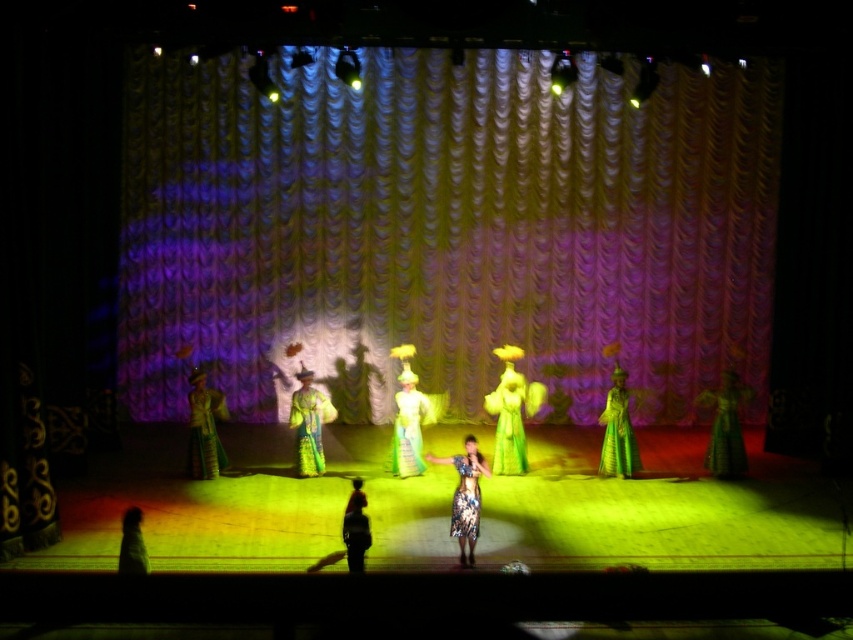
Looking at this image, you are a stagehand standing at the camera position. You need to place a microphone stand at point (x=428, y=404), which is 34.77 feet away from you. The microphone stand can extend up to 30 feet. Will the microphone stand reach that point?

The distance between the camera and point (x=428, y=404) is 34.77 feet, which exceeds the microphone stand extension limit of 30 feet. Therefore, the microphone stand cannot reach that point.

You are a stagehand trying to adjust the lighting for the performance. The spotlight needs to be placed directly above the matte gold curtain at center. Given the stage coordinates, where should you position the spotlight?

The spotlight should be positioned directly above the matte gold curtain at center at coordinates point (444, 228).

You are a photographer standing at the front of the stage. You want to capture a photo of the silk green dress at center. According to the coordinates provided, where should you aim your camera to ensure the dress is centered in the photo?

To center the silk green dress at center in the photo, aim your camera at the coordinates point (x=410, y=417) as that is where the silk green dress at center is positioned.